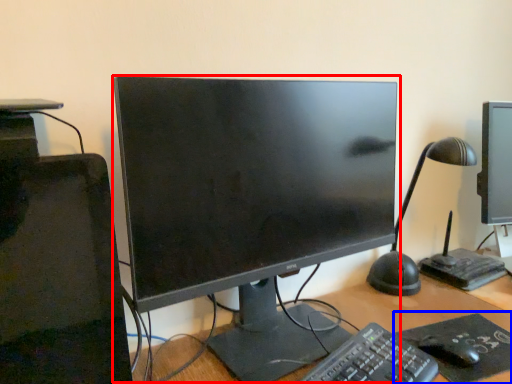
Question: Which object appears farthest to the camera in this image, computer monitor (highlighted by a red box) or mousepad (highlighted by a blue box)?

Choices:
 (A) computer monitor
 (B) mousepad

Answer: (B)